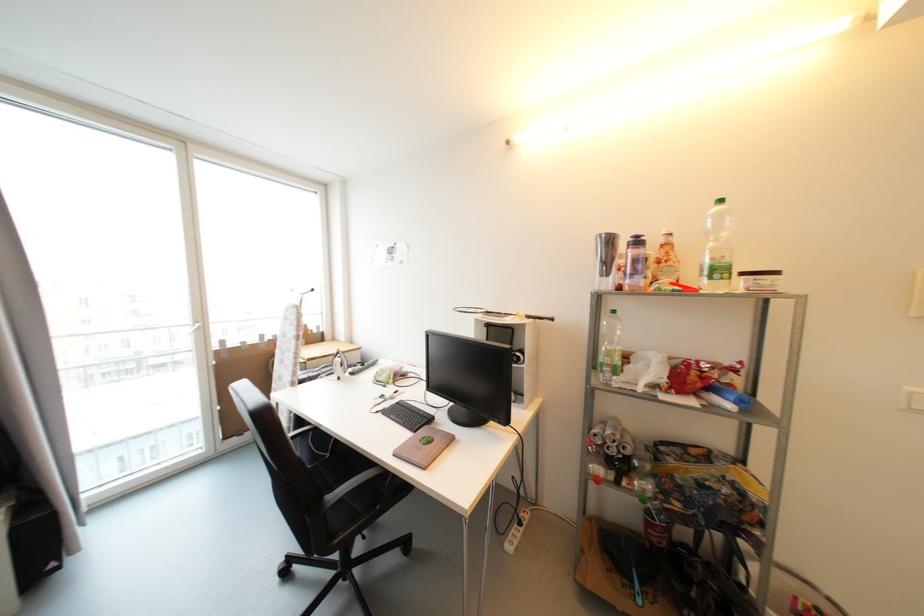
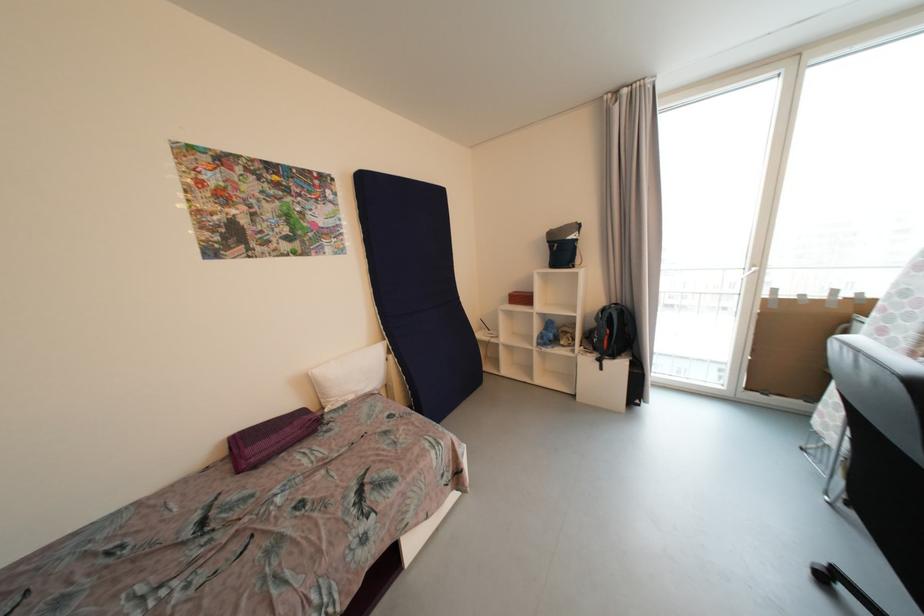
The point at (x=229, y=440) is marked in the first image. Where is the corresponding point in the second image?

(752, 390)